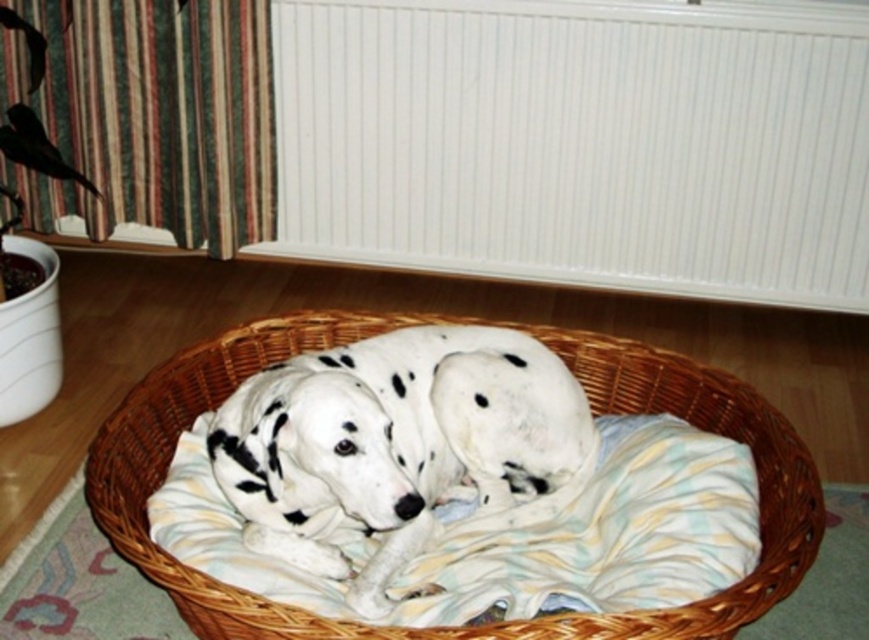
Does white plastic radiator at upper center have a lesser height compared to white-spotted fur at center?

No.

The image size is (869, 640). What are the coordinates of `white plastic radiator at upper center` in the screenshot? It's located at (580, 141).

Is point (638, 195) positioned behind point (355, 422)?

Yes, it is behind point (355, 422).

At what (x,y) coordinates should I click in order to perform the action: click on white plastic radiator at upper center. Please return your answer as a coordinate pair (x, y). Image resolution: width=869 pixels, height=640 pixels. Looking at the image, I should click on (580, 141).

How much distance is there between white-spotted fur at center and woven wood basket at center?

A distance of 10.20 inches exists between white-spotted fur at center and woven wood basket at center.

Who is more forward, [531,358] or [137,476]?

Point [137,476] is more forward.

Does point (289, 362) come behind point (105, 456)?

Yes, it is behind point (105, 456).

I want to click on white-spotted fur at center, so click(x=396, y=444).

Is white plastic radiator at upper center to the right of woven wood basket at center from the viewer's perspective?

Yes, white plastic radiator at upper center is to the right of woven wood basket at center.

Does point (795, 285) come in front of point (574, 624)?

No, it is not.

You are a GUI agent. You are given a task and a screenshot of the screen. Output one action in this format:
    pyautogui.click(x=<x>, y=<y>)
    Task: Click on the white plastic radiator at upper center
    The image size is (869, 640).
    Given the screenshot: What is the action you would take?
    pyautogui.click(x=580, y=141)